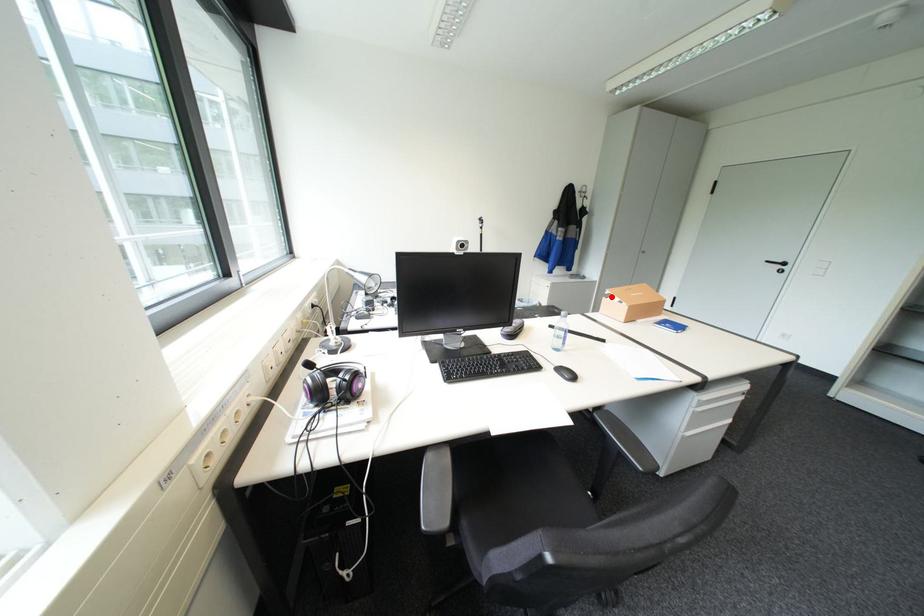
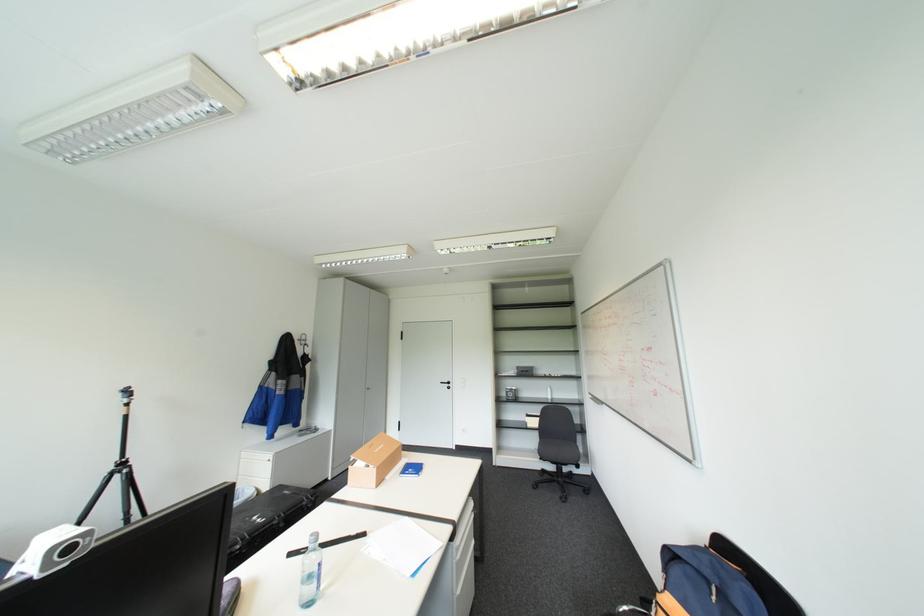
In the second image, find the point that corresponds to the highlighted location in the first image.

(358, 464)